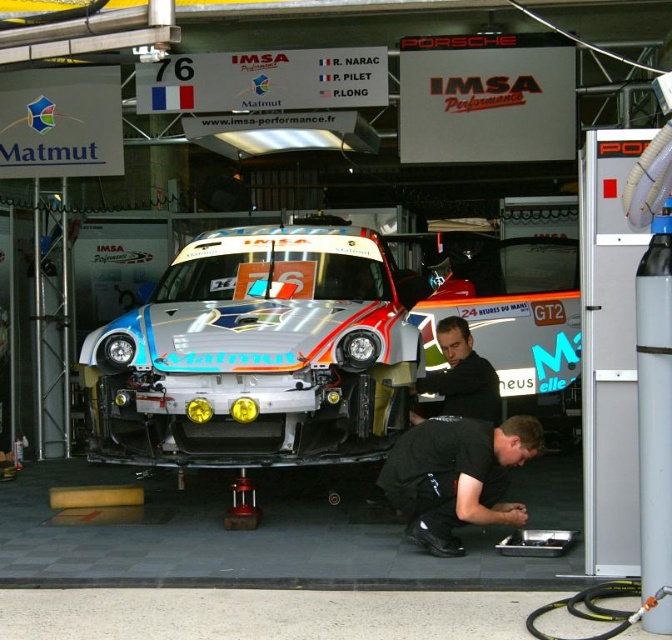
Question: Considering the real-world distances, which object is closest to the silver metallic car at center?

Choices:
 (A) black fabric shirt at center
 (B) black fabric squat at lower center

Answer: (A)

Question: Among these points, which one is farthest from the camera?

Choices:
 (A) 491,500
 (B) 495,403
 (C) 124,349

Answer: (B)

Question: From the image, what is the correct spatial relationship of black fabric squat at lower center in relation to black fabric shirt at center?

Choices:
 (A) right
 (B) left

Answer: (B)

Question: Can you confirm if silver metallic car at center is thinner than black fabric shirt at center?

Choices:
 (A) yes
 (B) no

Answer: (B)

Question: From the image, what is the correct spatial relationship of silver metallic car at center in relation to black fabric squat at lower center?

Choices:
 (A) right
 (B) left

Answer: (B)

Question: Which point is closer to the camera?

Choices:
 (A) (151, 460)
 (B) (452, 374)

Answer: (A)